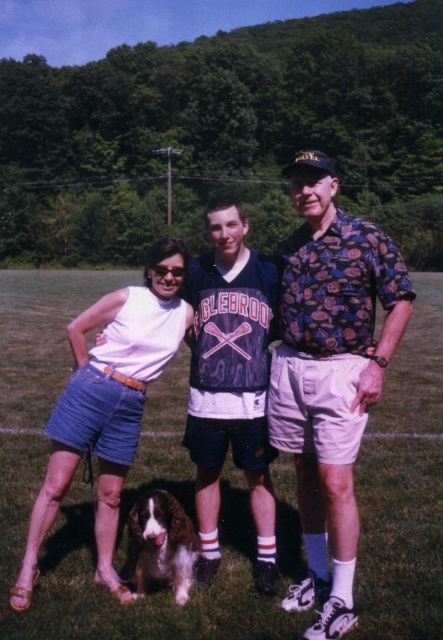
Question: Which of the following is the farthest from the observer?

Choices:
 (A) (171, 554)
 (B) (314, 314)
 (C) (232, 225)
 (D) (298, 333)

Answer: (C)

Question: Which of the following is the farthest from the observer?

Choices:
 (A) (225, 396)
 (B) (341, 451)
 (C) (356, 388)

Answer: (A)

Question: Does white jersey at center appear over white fur dog at lower center?

Choices:
 (A) yes
 (B) no

Answer: (A)

Question: Can you confirm if white cotton tank top at center is wider than white fur dog at lower center?

Choices:
 (A) no
 (B) yes

Answer: (A)

Question: Which point is closer to the camera?

Choices:
 (A) white cotton tank top at center
 (B) white fur dog at lower center

Answer: (B)

Question: Does floral-patterned shirt at center appear on the left side of white denim shorts at left?

Choices:
 (A) yes
 (B) no

Answer: (B)